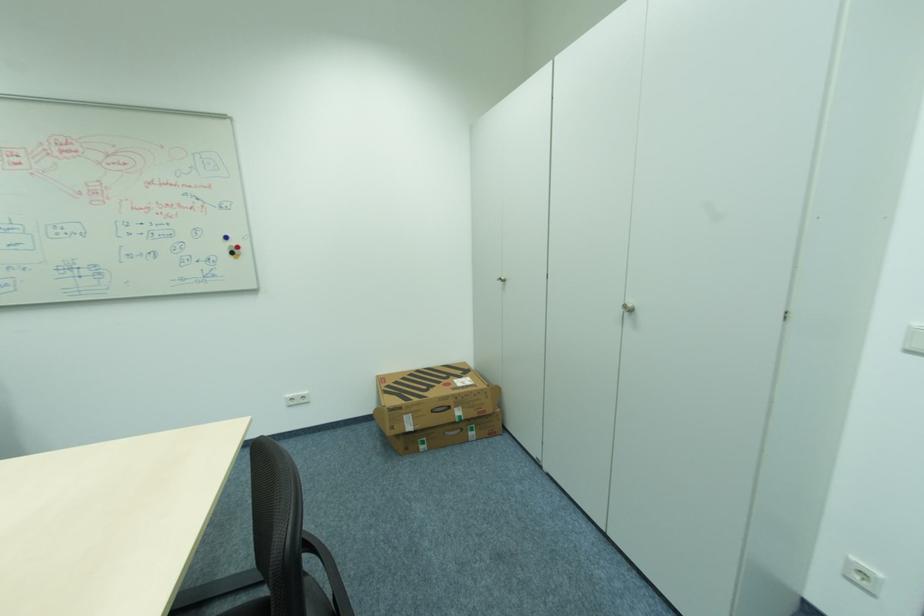
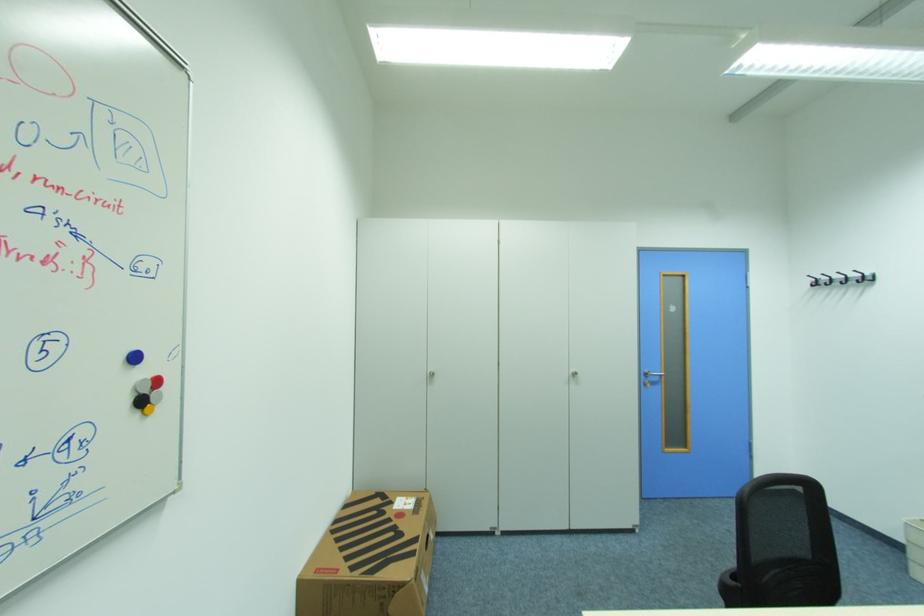
Locate, in the second image, the point that corresponds to (244,246) in the first image.

(162, 382)